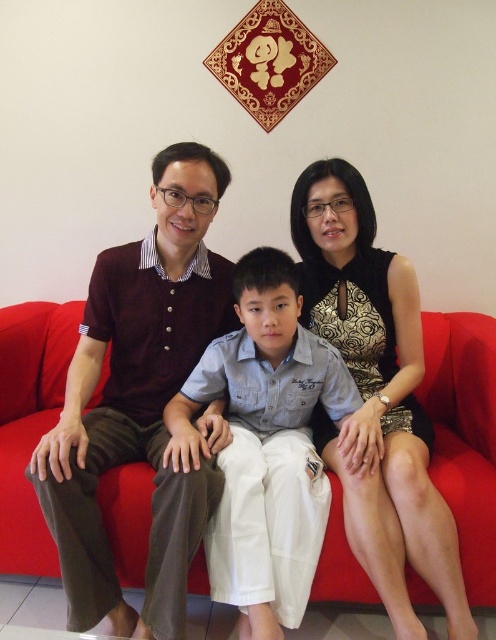
Does point (80, 355) lie in front of point (236, 275)?

No, it is behind (236, 275).

Which is above, maroon knitwear at center or light blue cotton shirt at center?

Positioned higher is maroon knitwear at center.

Describe the element at coordinates (140, 401) in the screenshot. Image resolution: width=496 pixels, height=640 pixels. I see `maroon knitwear at center` at that location.

Locate an element on the screen. maroon knitwear at center is located at coordinates (140, 401).

In the scene shown: Does maroon knitwear at center appear over red fabric couch at center?

Yes, maroon knitwear at center is above red fabric couch at center.

Who is lower down, maroon knitwear at center or red fabric couch at center?

red fabric couch at center

Image resolution: width=496 pixels, height=640 pixels. Identify the location of maroon knitwear at center. (140, 401).

In the scene shown: Can you confirm if black textured dress at center is thinner than light blue cotton shirt at center?

Yes, black textured dress at center is thinner than light blue cotton shirt at center.

Can you confirm if black textured dress at center is positioned to the right of light blue cotton shirt at center?

Indeed, black textured dress at center is positioned on the right side of light blue cotton shirt at center.

Image resolution: width=496 pixels, height=640 pixels. I want to click on black textured dress at center, so click(x=375, y=396).